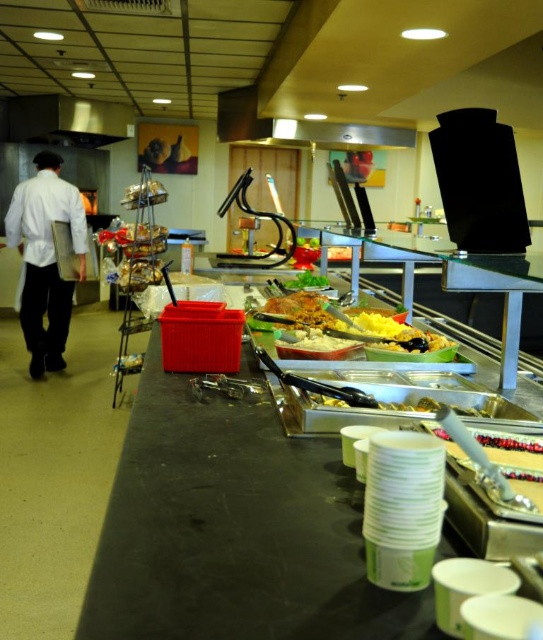
You are a customer standing at the counter in the cafeteria. You want to grab a serving of both the yellow matte food at center and the shiny orange pasta at center. Which one should you reach for first, and why?

You should reach for the yellow matte food at center first because it is closer to you than the shiny orange pasta at center.

You are a customer at the cafeteria and want to choose between the shiny orange pasta at center and the white creamy mashed potatoes at center. Which dish is closer to the left side of the display?

The shiny orange pasta at center is to the left of the white creamy mashed potatoes at center, so it is closer to the left side of the display.

You are a customer at the cafeteria and want to choose between the shiny orange pasta at center and the white creamy mashed potatoes at center. Which dish is located higher on the display counter?

The shiny orange pasta at center is above the white creamy mashed potatoes at center, so it is located higher on the display counter.